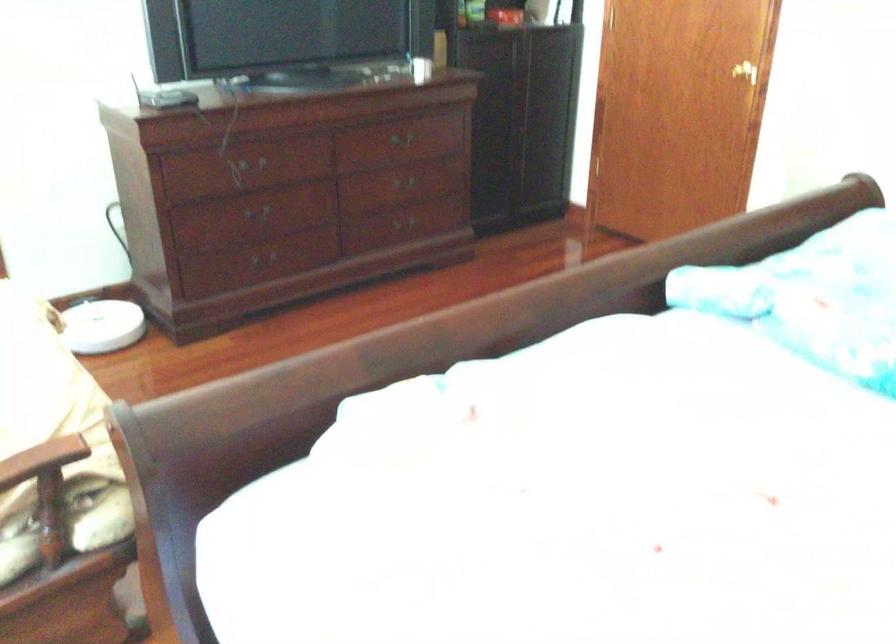
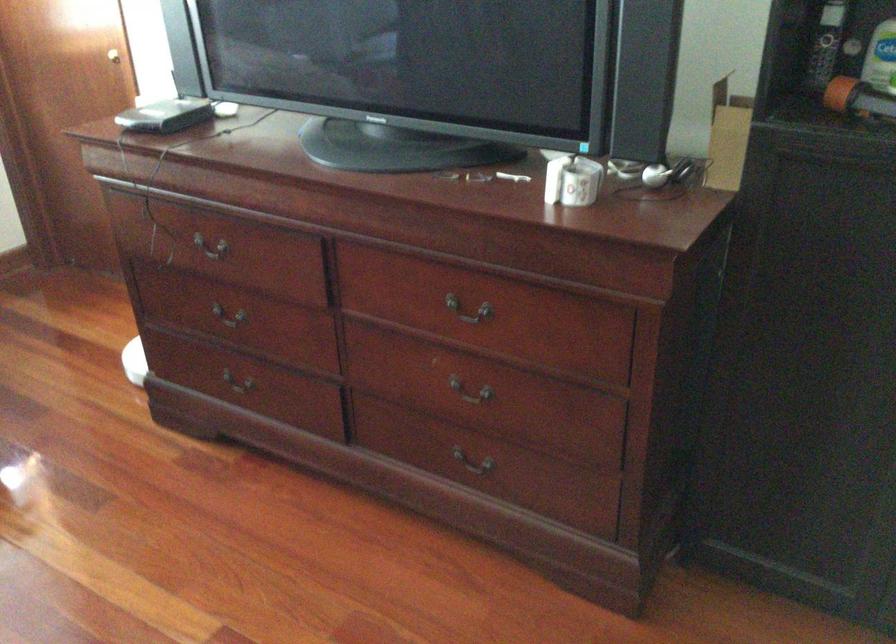
Find the pixel in the second image that matches the point at 389,230 in the first image.

(471, 466)